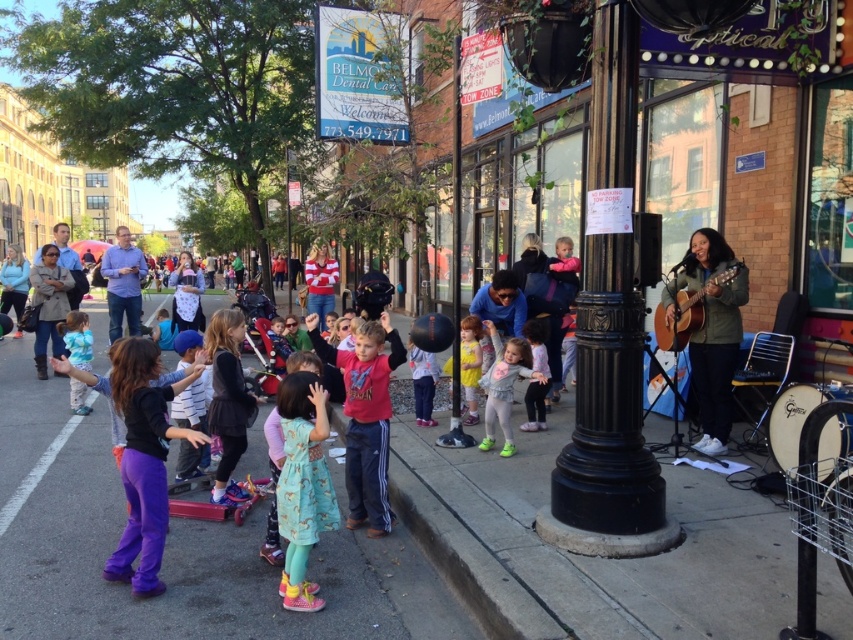
Question: Can you confirm if blue shirt at center is bigger than acoustic guitar at right?

Choices:
 (A) no
 (B) yes

Answer: (B)

Question: Which of the following is the farthest from the observer?

Choices:
 (A) (286, 440)
 (B) (688, 300)
 (C) (532, 364)
 (D) (714, 372)

Answer: (C)

Question: Which object is the closest to the yellow cotton shirt at center?

Choices:
 (A) light pink fabric dress at center
 (B) purple cotton pants at lower left
 (C) light blue fabric dress at lower left
 (D) dark gray jacket at left

Answer: (A)

Question: Which point appears closest to the camera in this image?

Choices:
 (A) (495, 385)
 (B) (120, 288)
 (C) (77, 412)
 (D) (525, 324)

Answer: (A)

Question: Is blue shirt at center above acoustic guitar at right?

Choices:
 (A) yes
 (B) no

Answer: (A)

Question: Is dark gray jacket at left to the left of matte black shirt at center from the viewer's perspective?

Choices:
 (A) no
 (B) yes

Answer: (B)